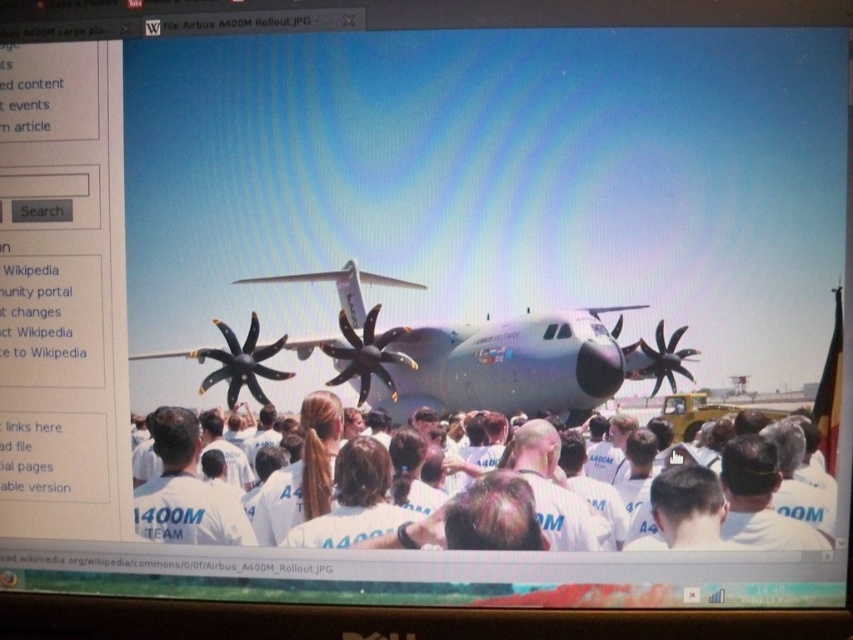
You are a photographer at the event and want to capture a photo of the silver metallic airplane at center without any people in the frame. Given that the white cotton shirt at center is blocking part of the airplane, can you adjust your position to take the photo?

The silver metallic airplane at center is in front of the white cotton shirt at center, so you can move your camera angle slightly to capture the airplane without the obstruction of the shirt.

You are a photographer at the A400M rollout event. You want to capture a photo of the Airbus A400M aircraft while ensuring that the white cotton shirt at center and the white cotton shirts at center are also visible in the frame. Given their proximity, will you need to adjust your camera angle to include both?

The white cotton shirt at center is only 3.78 inches away from the white cotton shirts at center, so they are very close to each other. Therefore, you can capture both the white cotton shirt at center and the white cotton shirts at center in the same frame without needing to adjust your camera angle significantly.